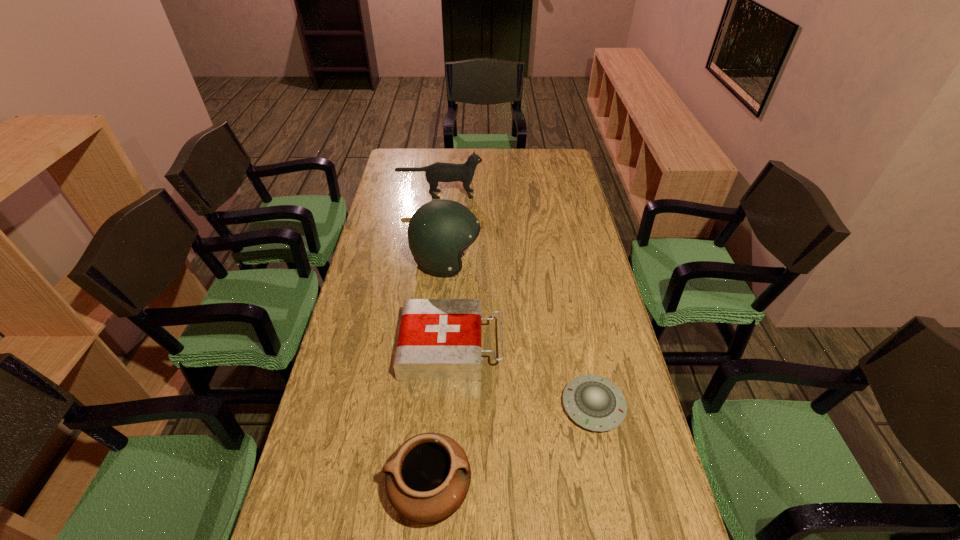
The image size is (960, 540). Find the location of `free location that satisfies the following two spatial constraints: 1. on the front-facing side of the third tallest object; 2. on the right side of the second tallest object`. free location that satisfies the following two spatial constraints: 1. on the front-facing side of the third tallest object; 2. on the right side of the second tallest object is located at coordinates (406, 490).

Where is `free space that satisfies the following two spatial constraints: 1. on the front side of the saucer; 2. on the right side of the first-aid kit`? free space that satisfies the following two spatial constraints: 1. on the front side of the saucer; 2. on the right side of the first-aid kit is located at coordinates (447, 406).

The width and height of the screenshot is (960, 540). Identify the location of free spot that satisfies the following two spatial constraints: 1. on the front-facing side of the shortest object; 2. on the left side of the farthest object. (416, 406).

Find the location of a particular element. The image size is (960, 540). vacant region that satisfies the following two spatial constraints: 1. on the front-facing side of the pottery; 2. on the right side of the cat is located at coordinates (406, 490).

Where is `free space that satisfies the following two spatial constraints: 1. at the face opening of the football helmet; 2. on the left side of the rightmost object`? free space that satisfies the following two spatial constraints: 1. at the face opening of the football helmet; 2. on the left side of the rightmost object is located at coordinates (434, 406).